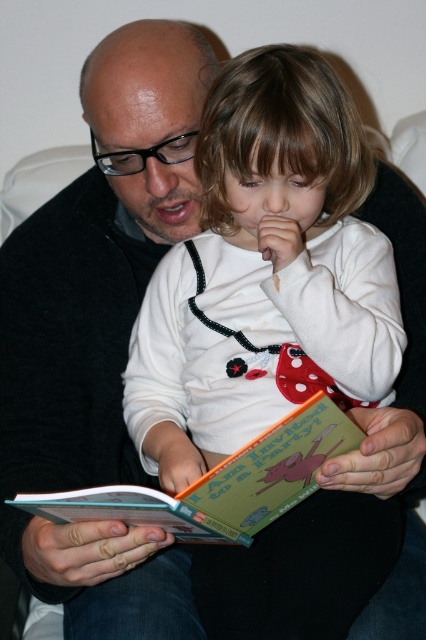
You are a tailor who needs to determine which item, the white soft fabric shirt at center or the hardcover book at center, requires more fabric for a custom order. Based on the image, which item would you prioritize for fabric allocation?

The white soft fabric shirt at center is larger in size than the hardcover book at center, so it would require more fabric and should be prioritized for fabric allocation.